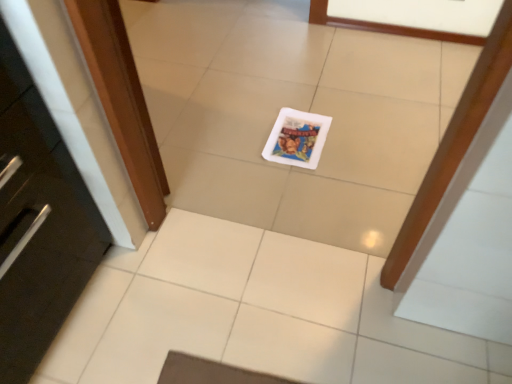
Measure the distance between point (289, 150) and camera.

5.09 feet.

Describe the element at coordinates (297, 138) in the screenshot. The image size is (512, 384). I see `white matte postcard at center` at that location.

At what (x,y) coordinates should I click in order to perform the action: click on white matte postcard at center. Please return your answer as a coordinate pair (x, y). Looking at the image, I should click on (297, 138).

Locate an element on the screen. This screenshot has width=512, height=384. white matte postcard at center is located at coordinates (297, 138).